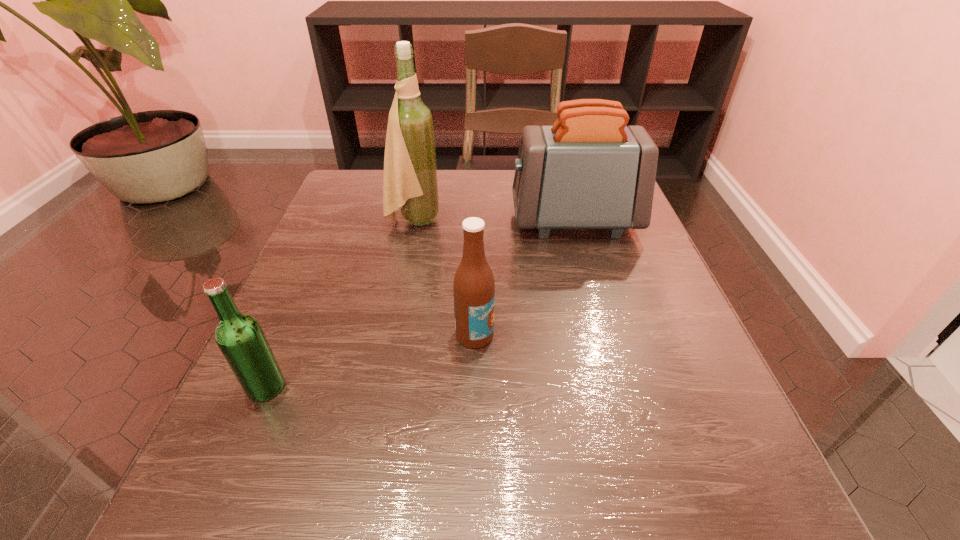
Locate an element on the screen. Image resolution: width=960 pixels, height=540 pixels. wine bottle is located at coordinates (410, 183).

At what (x,y) coordinates should I click in order to perform the action: click on the tallest object. Please return your answer as a coordinate pair (x, y). Looking at the image, I should click on (410, 183).

Where is `the rightmost object`? the rightmost object is located at coordinates (589, 170).

The height and width of the screenshot is (540, 960). I want to click on the right beer bottle, so click(474, 287).

Where is `the farther beer bottle`? This screenshot has height=540, width=960. the farther beer bottle is located at coordinates 474,287.

The width and height of the screenshot is (960, 540). Identify the location of the nearer beer bottle. (239, 336).

Image resolution: width=960 pixels, height=540 pixels. I want to click on the left beer bottle, so click(x=239, y=336).

The height and width of the screenshot is (540, 960). Find the location of `vacant space situated on the front-facing side of the wine bottle`. vacant space situated on the front-facing side of the wine bottle is located at coordinates (610, 221).

This screenshot has width=960, height=540. In order to click on free space located on the front-facing side of the toaster in this screenshot , I will do pyautogui.click(x=400, y=221).

You are a GUI agent. You are given a task and a screenshot of the screen. Output one action in this format:
    pyautogui.click(x=<x>, y=<y>)
    Task: Click on the free space located on the front-facing side of the toaster
    The width and height of the screenshot is (960, 540).
    Given the screenshot: What is the action you would take?
    pyautogui.click(x=454, y=221)